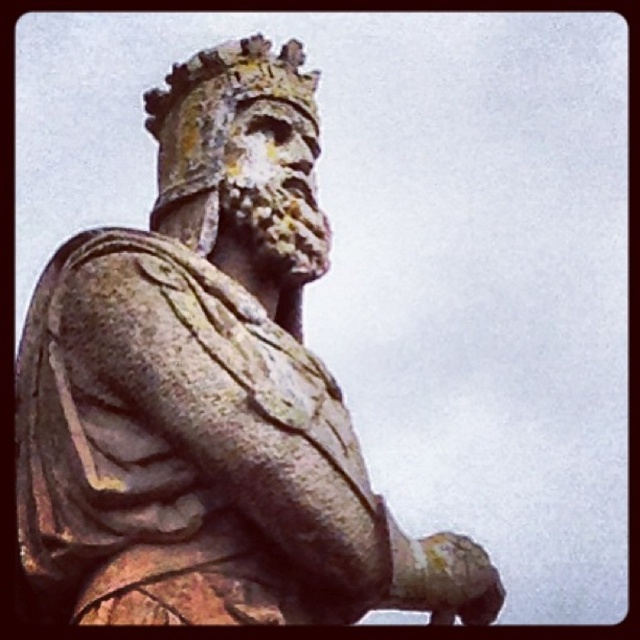
Is rusty stone statue at center closer to camera compared to rusty stone crown at upper center?

Yes, rusty stone statue at center is closer to the viewer.

Can you confirm if rusty stone statue at center is smaller than rusty stone crown at upper center?

No, rusty stone statue at center is not smaller than rusty stone crown at upper center.

Is point (276, 468) less distant than point (296, 96)?

Yes, point (276, 468) is closer to viewer.

Where is `rusty stone statue at center`? rusty stone statue at center is located at coordinates (211, 394).